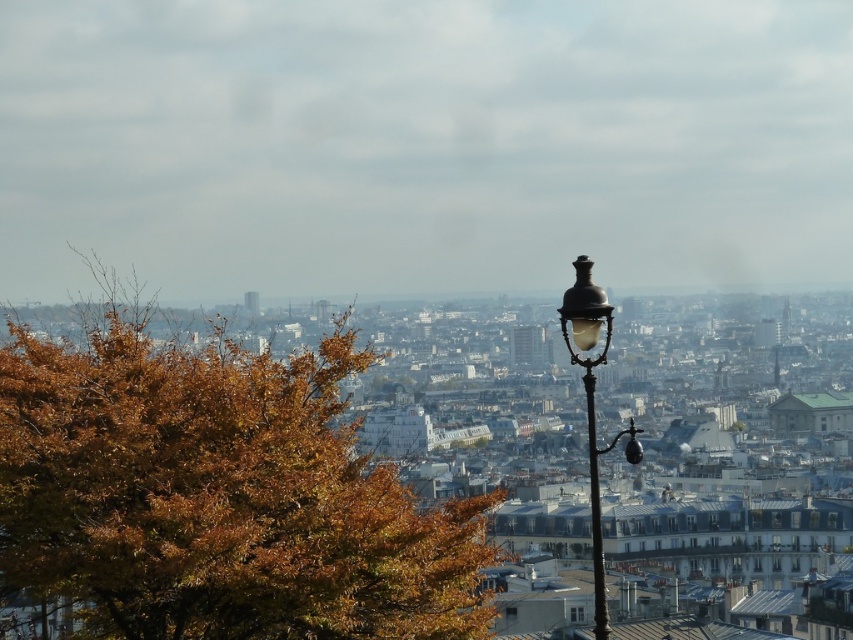
You are a tourist standing in the city center and want to take a photo that includes both the brown leafy tree at left and the black metal pole at right. Based on their positions, which object should you position closer to the left side of your camera frame?

The brown leafy tree at left is to the left of the black metal pole at right, so you should position the brown leafy tree at left closer to the left side of your camera frame.

You are a photographer planning to capture a cityscape with the brown leafy tree at left and the black metal pole at right in the frame. Which object will appear higher in the photo?

The brown leafy tree at left appears higher in the photo because it is positioned above the black metal pole at right according to the description.

You are standing in the cityscape and want to take a photo of the iconic lamppost in the foreground. To ensure the brown leafy tree at left is not blocking your view, which direction should you move relative to the tree?

You should move to the right relative to the brown leafy tree at left because it is located at the left side of the scene, so moving right would position you away from the tree and provide an unobstructed view of the lamppost.